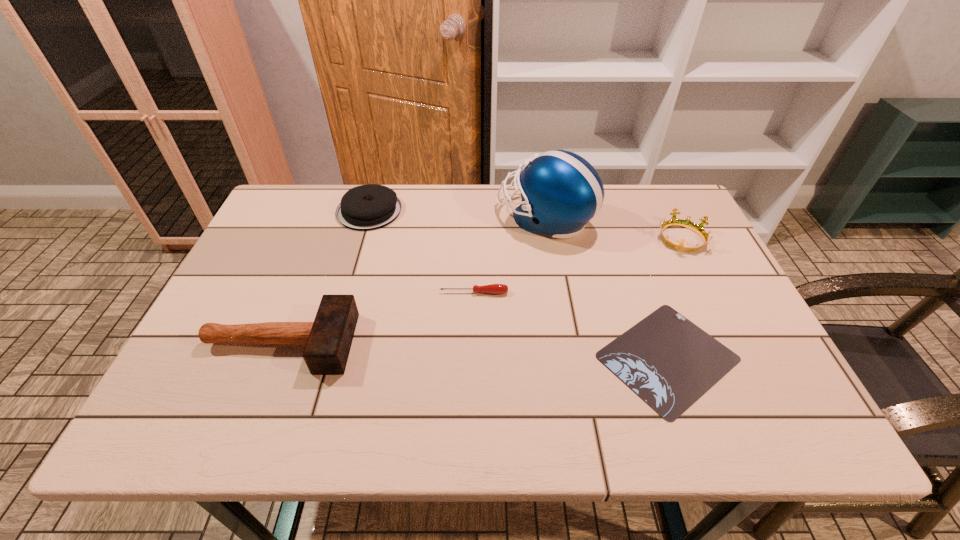
In order to click on crown positioned at the right edge in this screenshot , I will do `click(686, 223)`.

This screenshot has height=540, width=960. In order to click on mousepad that is at the right edge in this screenshot , I will do `click(669, 362)`.

The width and height of the screenshot is (960, 540). I want to click on object that is at the far right corner, so click(x=686, y=223).

The image size is (960, 540). In order to click on object present at the near right corner in this screenshot , I will do `click(669, 362)`.

Image resolution: width=960 pixels, height=540 pixels. In the image, there is a desktop. In order to click on free space at the far edge in this screenshot , I will do `click(407, 188)`.

You are a GUI agent. You are given a task and a screenshot of the screen. Output one action in this format:
    pyautogui.click(x=<x>, y=<y>)
    Task: Click on the vacant space at the near edge of the desktop
    The height and width of the screenshot is (540, 960).
    Given the screenshot: What is the action you would take?
    pyautogui.click(x=346, y=404)

The width and height of the screenshot is (960, 540). Find the location of `vacant area at the left edge`. vacant area at the left edge is located at coordinates (264, 294).

Locate an element on the screen. free spot at the right edge of the desktop is located at coordinates (760, 339).

You are a GUI agent. You are given a task and a screenshot of the screen. Output one action in this format:
    pyautogui.click(x=<x>, y=<y>)
    Task: Click on the free spot at the far right corner of the desktop
    
    Given the screenshot: What is the action you would take?
    pyautogui.click(x=661, y=225)

Identify the location of free space between the shortest object and the tallest object. Image resolution: width=960 pixels, height=540 pixels. 607,288.